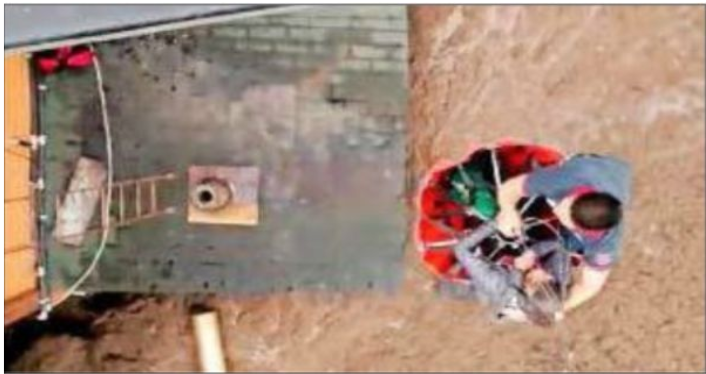
Identify the location of wood board. The image size is (706, 374). (17, 186).